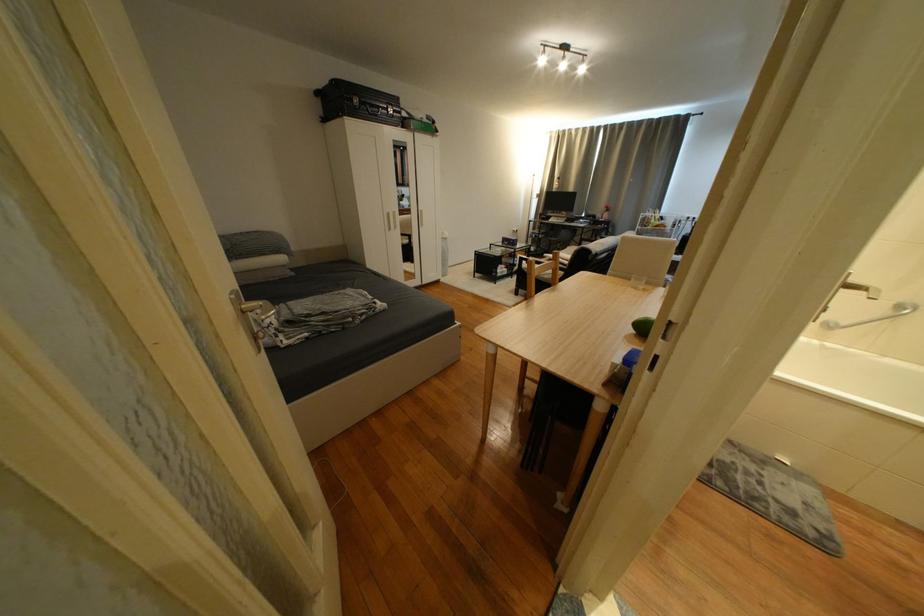
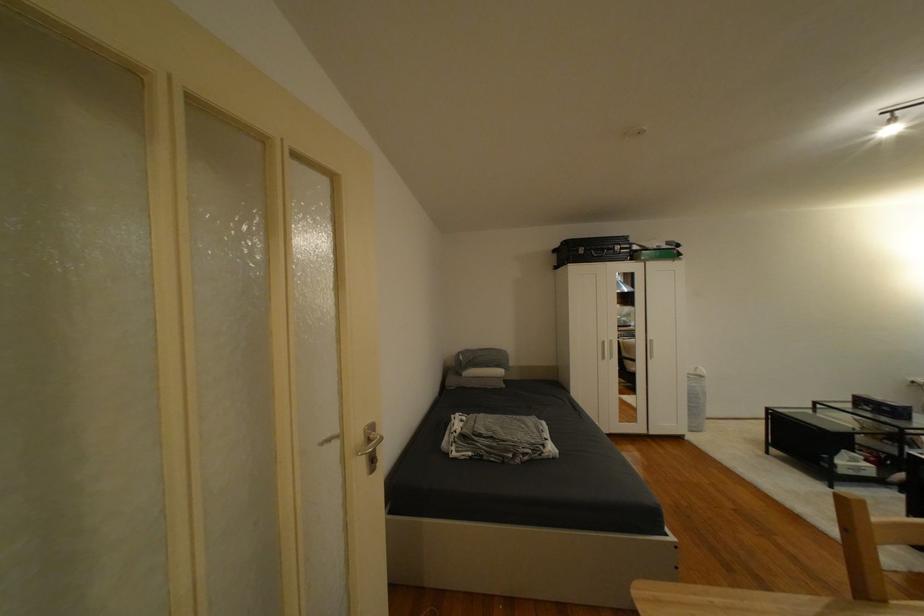
Where in the second image is the point corresponding to [332,314] from the first image?

(500, 439)